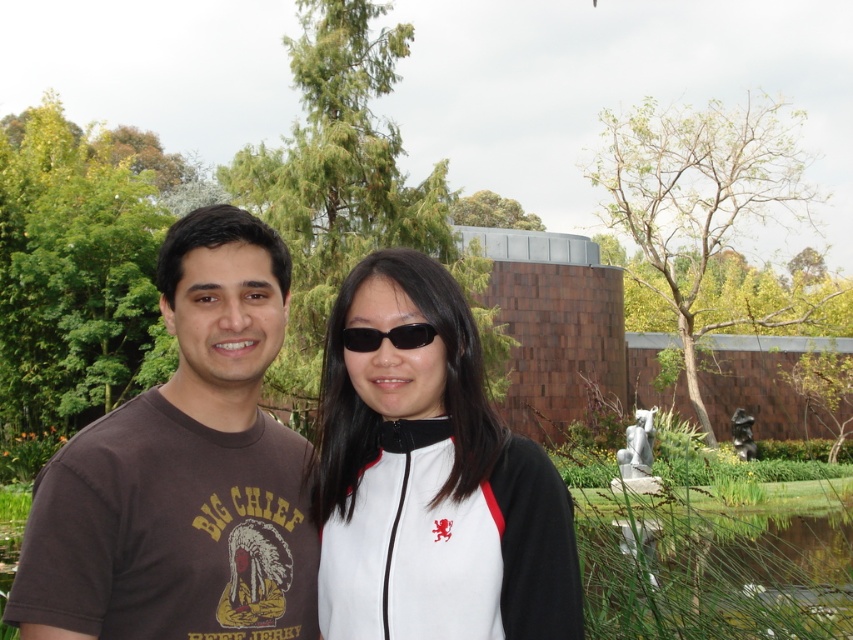
Question: Where is brown t-shirt at left located in relation to black plastic sunglasses at center in the image?

Choices:
 (A) below
 (B) above

Answer: (A)

Question: Can you confirm if brown t-shirt at left is thinner than black plastic sunglasses at center?

Choices:
 (A) yes
 (B) no

Answer: (B)

Question: Which is farther from the black plastic sunglasses at center?

Choices:
 (A) brown t-shirt at left
 (B) white matte jacket at center

Answer: (A)

Question: Which object is farther from the camera taking this photo?

Choices:
 (A) black plastic sunglasses at center
 (B) brown t-shirt at left

Answer: (A)

Question: Which of the following is the closest to the observer?

Choices:
 (A) (397, 337)
 (B) (366, 612)
 (C) (186, 397)

Answer: (B)

Question: Is white matte jacket at center further to the viewer compared to black plastic sunglasses at center?

Choices:
 (A) no
 (B) yes

Answer: (A)